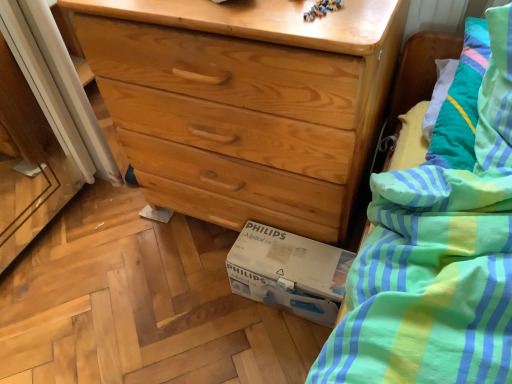
Question: Considering the relative sizes of white cardboard box at lower center and natural wood chest of drawers at center in the image provided, is white cardboard box at lower center taller than natural wood chest of drawers at center?

Choices:
 (A) no
 (B) yes

Answer: (A)

Question: Is the depth of white cardboard box at lower center greater than that of natural wood chest of drawers at center?

Choices:
 (A) yes
 (B) no

Answer: (A)

Question: Would you say white cardboard box at lower center is a long distance from natural wood chest of drawers at center?

Choices:
 (A) no
 (B) yes

Answer: (A)

Question: Is white cardboard box at lower center at the left side of natural wood chest of drawers at center?

Choices:
 (A) yes
 (B) no

Answer: (B)

Question: Could natural wood chest of drawers at center be considered to be inside white cardboard box at lower center?

Choices:
 (A) no
 (B) yes

Answer: (A)

Question: Is white cardboard box at lower center wider than natural wood chest of drawers at center?

Choices:
 (A) no
 (B) yes

Answer: (A)

Question: Does natural wood chest of drawers at center lie behind white cardboard box at lower center?

Choices:
 (A) no
 (B) yes

Answer: (A)

Question: Can you confirm if natural wood chest of drawers at center is shorter than white cardboard box at lower center?

Choices:
 (A) yes
 (B) no

Answer: (B)

Question: From the image's perspective, is natural wood chest of drawers at center on top of white cardboard box at lower center?

Choices:
 (A) yes
 (B) no

Answer: (A)

Question: Is natural wood chest of drawers at center to the right of white cardboard box at lower center from the viewer's perspective?

Choices:
 (A) no
 (B) yes

Answer: (A)

Question: Can you confirm if natural wood chest of drawers at center is bigger than white cardboard box at lower center?

Choices:
 (A) yes
 (B) no

Answer: (A)

Question: From a real-world perspective, is natural wood chest of drawers at center beneath white cardboard box at lower center?

Choices:
 (A) no
 (B) yes

Answer: (A)

Question: Is natural wood chest of drawers at center wider or thinner than white cardboard box at lower center?

Choices:
 (A) wide
 (B) thin

Answer: (A)